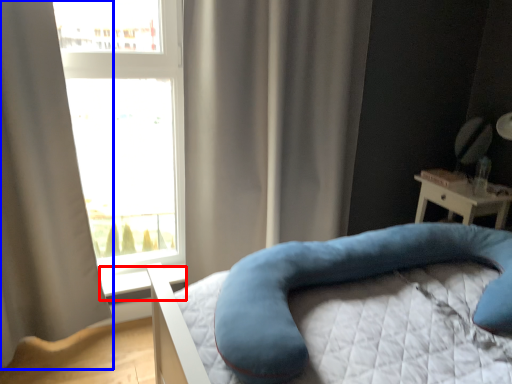
Question: Which object appears farthest to the camera in this image, window sill (highlighted by a red box) or curtain (highlighted by a blue box)?

Choices:
 (A) window sill
 (B) curtain

Answer: (A)